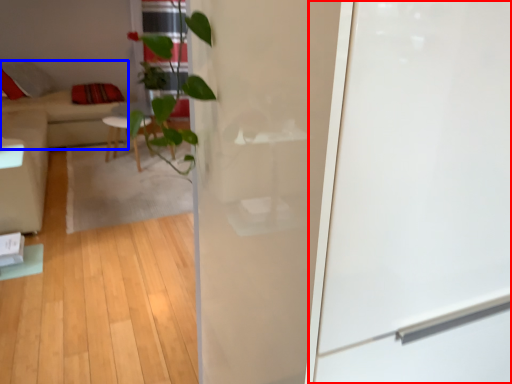
Question: Which object is closer to the camera taking this photo, screen door (highlighted by a red box) or couch (highlighted by a blue box)?

Choices:
 (A) screen door
 (B) couch

Answer: (A)